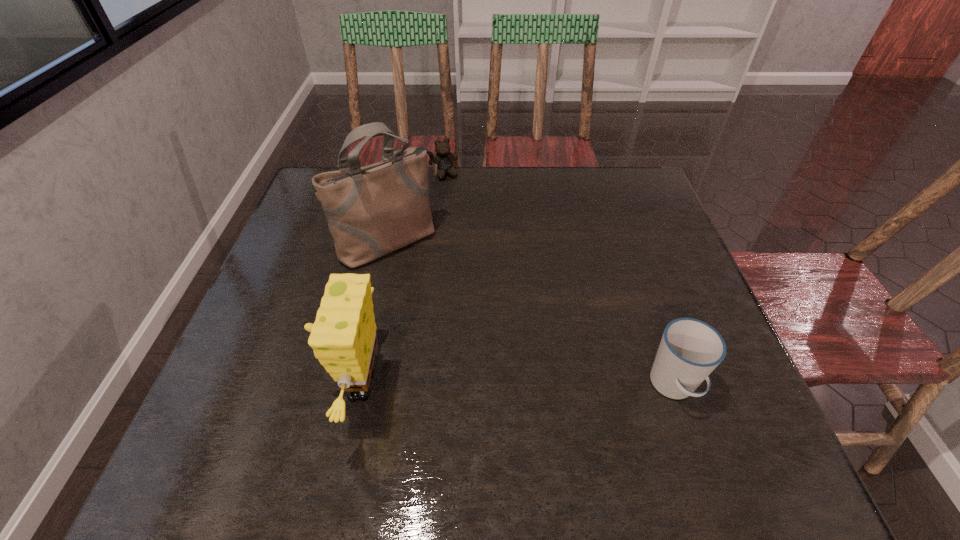
The width and height of the screenshot is (960, 540). Find the location of `vacant space on the desktop that is between the second tallest object and the cup and is positioned on the face of the shortest object`. vacant space on the desktop that is between the second tallest object and the cup and is positioned on the face of the shortest object is located at coordinates (558, 386).

Where is `free spot on the desktop that is between the sponge and the rightmost object and is positioned on the front-facing side of the tallest object`? The height and width of the screenshot is (540, 960). free spot on the desktop that is between the sponge and the rightmost object and is positioned on the front-facing side of the tallest object is located at coordinates (524, 386).